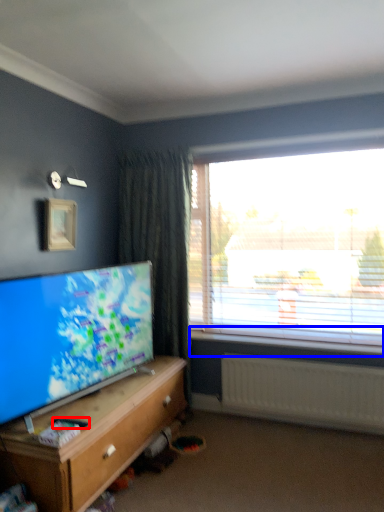
Question: Which point is further to the camera, remote control (highlighted by a red box) or window sill (highlighted by a blue box)?

Choices:
 (A) remote control
 (B) window sill

Answer: (B)